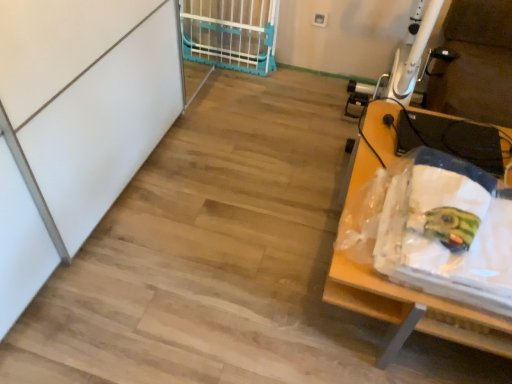
Locate an element on the screen. The width and height of the screenshot is (512, 384). free space in front of blue plastic gate at upper center is located at coordinates (230, 94).